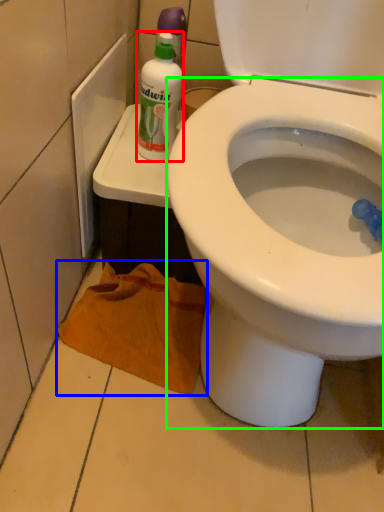
Question: Which object is the closest to the cleaning product (highlighted by a red box)? Choose among these: material (highlighted by a blue box) or bidet (highlighted by a green box).

Choices:
 (A) material
 (B) bidet

Answer: (B)